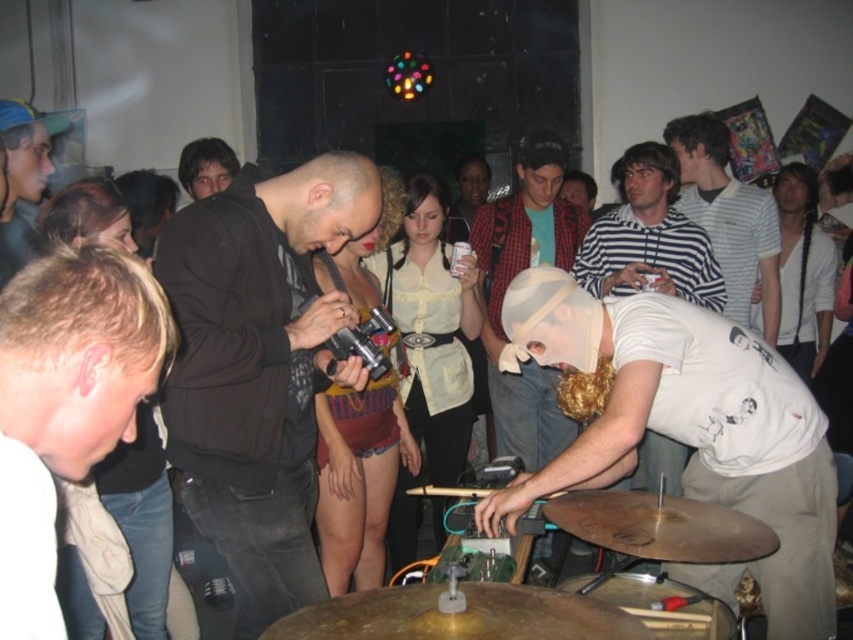
Question: Does matte black jacket at upper left have a larger size compared to shiny gold cymbal at lower center?

Choices:
 (A) yes
 (B) no

Answer: (A)

Question: Among these objects, which one is nearest to the camera?

Choices:
 (A) shiny gold cymbal at lower center
 (B) striped cotton shirt at upper right

Answer: (A)

Question: Can you confirm if red plaid shirt at center is positioned below shiny gold cymbal at lower center?

Choices:
 (A) yes
 (B) no

Answer: (B)

Question: Does gold metallic cymbal at center have a greater width compared to matte black jacket at upper left?

Choices:
 (A) no
 (B) yes

Answer: (B)

Question: Which object is farther from the camera taking this photo?

Choices:
 (A) white cotton shirt at center
 (B) white matte shirt at lower left
 (C) shiny gold cymbal at lower center
 (D) red plaid shirt at center

Answer: (D)

Question: Which of these objects is positioned farthest from the matte black jacket at upper left?

Choices:
 (A) red plaid shirt at center
 (B) white matte shirt at lower left

Answer: (A)